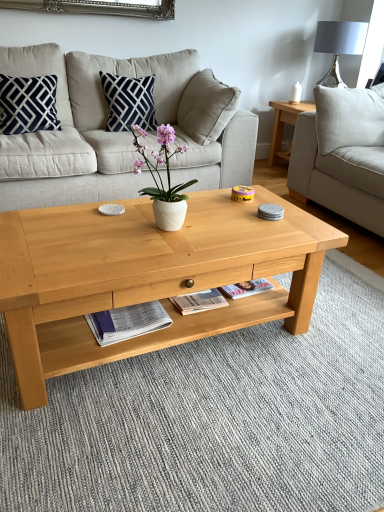
Image resolution: width=384 pixels, height=512 pixels. Find the location of `free space above natural wood coffee table at center (from a real-world perspective)`. free space above natural wood coffee table at center (from a real-world perspective) is located at coordinates (152, 230).